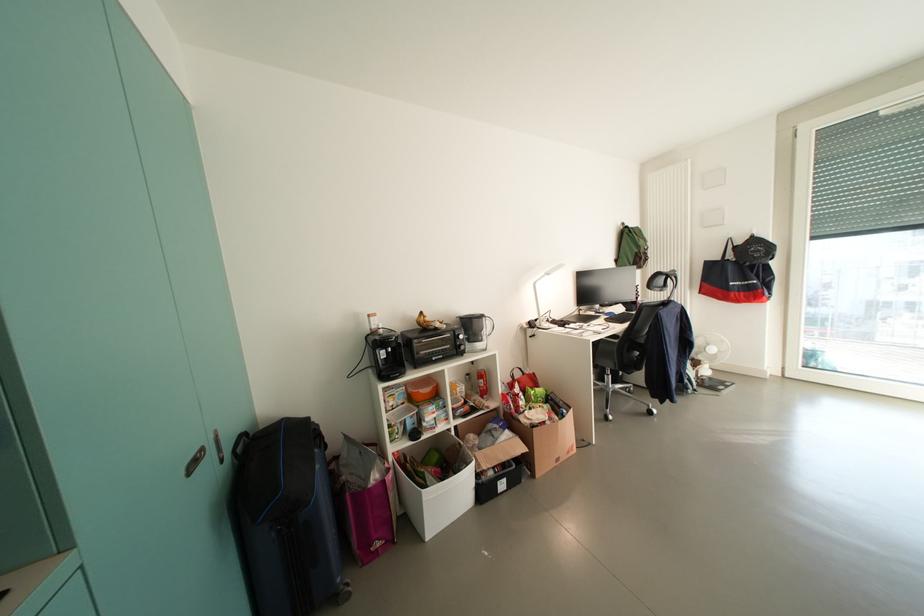
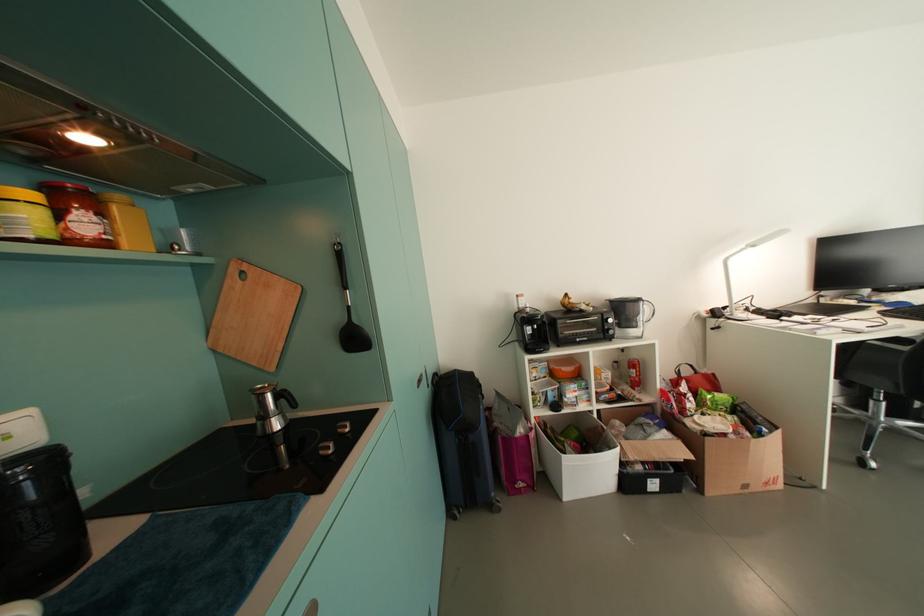
Question: The images are taken continuously from a first-person perspective. In which direction is your viewpoint rotating?

Choices:
 (A) Left
 (B) Right
 (C) Up
 (D) Down

Answer: (A)